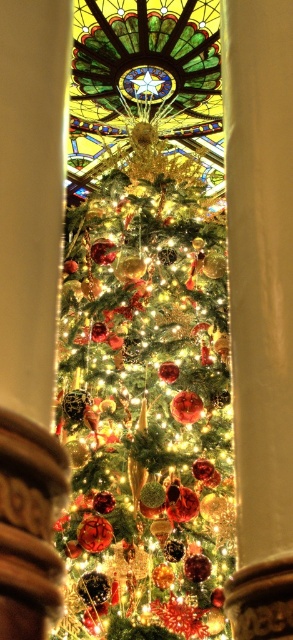
Find the location of `glossy glass ornaments at center`. glossy glass ornaments at center is located at coordinates (145, 396).

Can you confirm if glossy glass ornaments at center is positioned above stained glass at center?

No, glossy glass ornaments at center is not above stained glass at center.

Between point (152, 291) and point (193, 77), which one is positioned behind?

The point (193, 77) is behind.

I want to click on glossy glass ornaments at center, so click(145, 396).